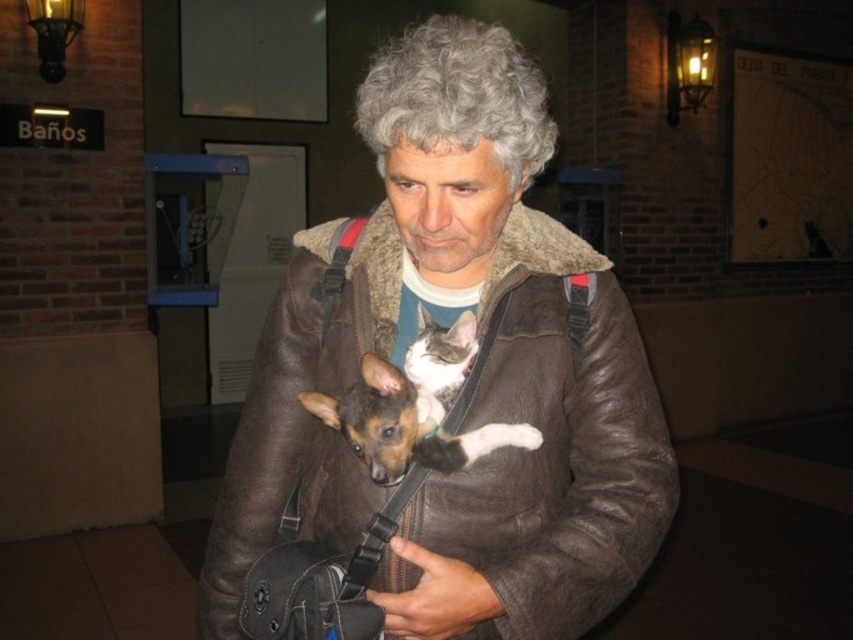
Can you confirm if brown leather jacket at center is positioned above gray curly wig at center?

Actually, brown leather jacket at center is below gray curly wig at center.

Is brown leather jacket at center positioned in front of gray curly wig at center?

No, brown leather jacket at center is behind gray curly wig at center.

Image resolution: width=853 pixels, height=640 pixels. What do you see at coordinates (555, 445) in the screenshot?
I see `brown leather jacket at center` at bounding box center [555, 445].

Where is `brown leather jacket at center`? brown leather jacket at center is located at coordinates (555, 445).

Who is positioned more to the right, brown leather jacket at center or brown leather dog at center?

brown leather dog at center

Can you confirm if brown leather jacket at center is positioned to the right of brown leather dog at center?

Incorrect, brown leather jacket at center is not on the right side of brown leather dog at center.

Describe the element at coordinates (555, 445) in the screenshot. I see `brown leather jacket at center` at that location.

The image size is (853, 640). In order to click on brown leather jacket at center in this screenshot , I will do `click(555, 445)`.

Is gray curly wig at center thinner than brown leather dog at center?

In fact, gray curly wig at center might be wider than brown leather dog at center.

Can you confirm if gray curly wig at center is shorter than brown leather dog at center?

In fact, gray curly wig at center may be taller than brown leather dog at center.

The image size is (853, 640). I want to click on gray curly wig at center, so click(457, 97).